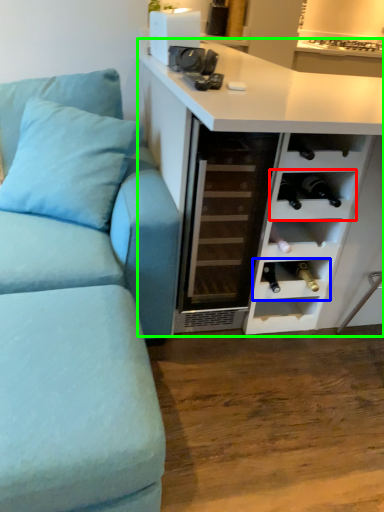
Question: Which is nearer to the shelf (highlighted by a red box)? shelf (highlighted by a blue box) or cabinetry (highlighted by a green box).

Choices:
 (A) shelf
 (B) cabinetry

Answer: (B)